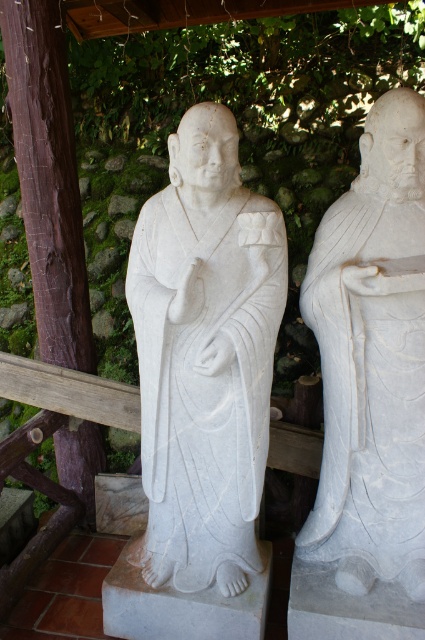
Question: Which of the following is the farthest from the observer?

Choices:
 (A) brown wood at left
 (B) white marble statue at right
 (C) white marble statue at center

Answer: (A)

Question: Can you confirm if white marble statue at center is wider than white marble statue at right?

Choices:
 (A) yes
 (B) no

Answer: (A)

Question: Among these objects, which one is nearest to the camera?

Choices:
 (A) white marble statue at center
 (B) white marble statue at right
 (C) brown wood at left

Answer: (B)

Question: Observing the image, what is the correct spatial positioning of white marble statue at center in reference to white marble statue at right?

Choices:
 (A) below
 (B) above

Answer: (A)

Question: Does white marble statue at right appear over brown wood at left?

Choices:
 (A) no
 (B) yes

Answer: (A)

Question: Which object is closer to the camera taking this photo?

Choices:
 (A) brown wood at left
 (B) white marble statue at right
 (C) white marble statue at center

Answer: (B)